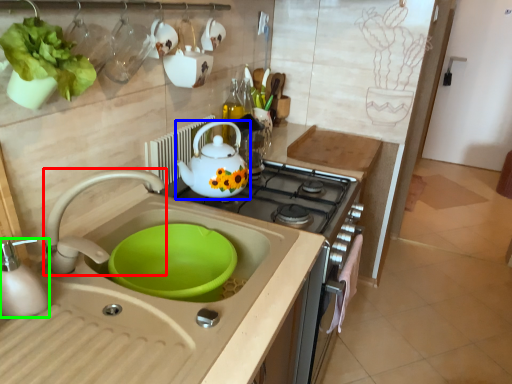
Question: Which object is the closest to the tap (highlighted by a red box)? Choose among these: teapot (highlighted by a blue box) or kitchen appliance (highlighted by a green box).

Choices:
 (A) teapot
 (B) kitchen appliance

Answer: (B)